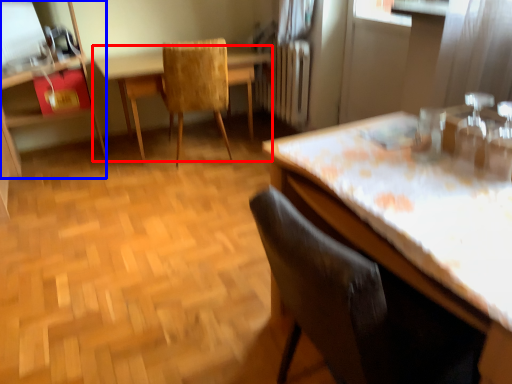
Question: Which object is further to the camera taking this photo, table (highlighted by a red box) or dresser (highlighted by a blue box)?

Choices:
 (A) table
 (B) dresser

Answer: (A)